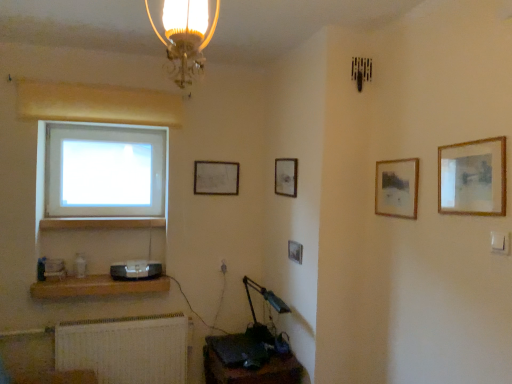
Question: Does brown wooden shelf at lower left appear on the right side of satin black speaker at lower left?

Choices:
 (A) yes
 (B) no

Answer: (B)

Question: From a real-world perspective, is brown wooden shelf at lower left positioned under satin black speaker at lower left based on gravity?

Choices:
 (A) no
 (B) yes

Answer: (B)

Question: Is brown wooden shelf at lower left not within satin black speaker at lower left?

Choices:
 (A) no
 (B) yes

Answer: (B)

Question: Does brown wooden shelf at lower left have a greater width compared to satin black speaker at lower left?

Choices:
 (A) no
 (B) yes

Answer: (B)

Question: Can you confirm if brown wooden shelf at lower left is shorter than satin black speaker at lower left?

Choices:
 (A) yes
 (B) no

Answer: (A)

Question: From the image's perspective, is brown wooden shelf at lower left beneath satin black speaker at lower left?

Choices:
 (A) no
 (B) yes

Answer: (B)

Question: Does wooden framed picture at upper right, arranged as the fourth picture frame when viewed from the back, appear on the right side of wooden picture frame at center, which is counted as the 3th picture frame, starting from the front?

Choices:
 (A) no
 (B) yes

Answer: (B)

Question: Are wooden framed picture at upper right, the 2th picture frame viewed from the front, and wooden picture frame at center, which ranks as the 3th picture frame in back-to-front order, far apart?

Choices:
 (A) yes
 (B) no

Answer: (B)

Question: From a real-world perspective, is wooden framed picture at upper right, the 2th picture frame viewed from the front, under wooden picture frame at center, which ranks as the third picture frame in left-to-right order?

Choices:
 (A) yes
 (B) no

Answer: (B)

Question: Does wooden framed picture at upper right, the 4th picture frame positioned from the left, have a greater height compared to wooden picture frame at center, which is counted as the 3th picture frame, starting from the front?

Choices:
 (A) yes
 (B) no

Answer: (A)

Question: From the image's perspective, is wooden framed picture at upper right, the 4th picture frame positioned from the left, on wooden picture frame at center, which ranks as the 3th picture frame in back-to-front order?

Choices:
 (A) no
 (B) yes

Answer: (B)

Question: Is wooden framed picture at upper right, which is the 2th picture frame in right-to-left order, closer to the viewer compared to wooden picture frame at center, the third picture frame when ordered from right to left?

Choices:
 (A) yes
 (B) no

Answer: (A)

Question: Is matte silver picture frame at upper center, the first picture frame from the left, positioned with its back to satin black speaker at lower left?

Choices:
 (A) no
 (B) yes

Answer: (A)